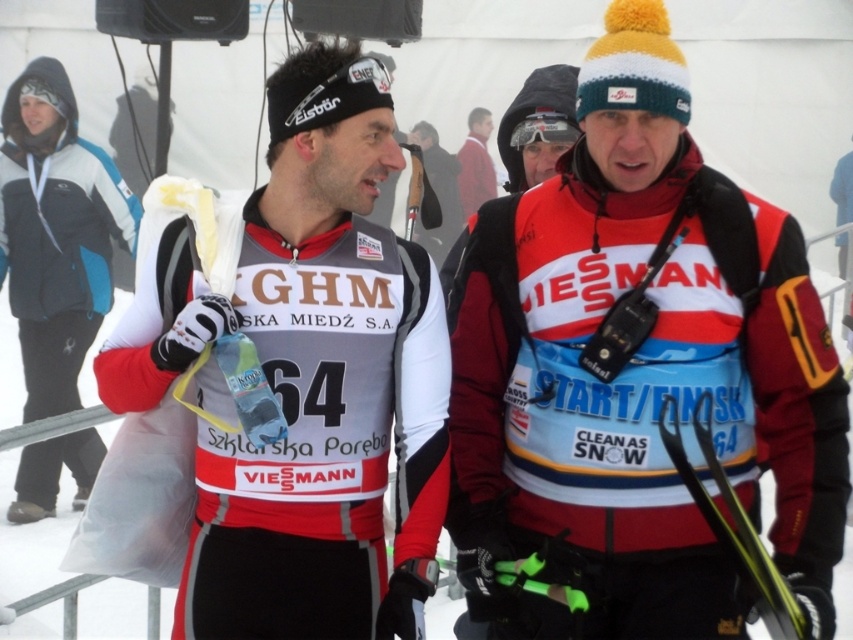
Between matte white jersey at center and matte black goggles at center, which one has more height?

Standing taller between the two is matte white jersey at center.

Can you confirm if matte white jersey at center is positioned below matte black goggles at center?

Yes.

Locate an element on the screen. matte white jersey at center is located at coordinates [310, 380].

Is red fabric jacket at center to the left of yellow metallic ski at lower right from the viewer's perspective?

Indeed, red fabric jacket at center is positioned on the left side of yellow metallic ski at lower right.

Which is below, red fabric jacket at center or yellow metallic ski at lower right?

yellow metallic ski at lower right is below.

Where is `red fabric jacket at center`? Image resolution: width=853 pixels, height=640 pixels. red fabric jacket at center is located at coordinates (636, 371).

Can you confirm if yellow metallic ski at lower right is positioned to the left of matte black goggles at center?

Incorrect, yellow metallic ski at lower right is not on the left side of matte black goggles at center.

Which of these two, yellow metallic ski at lower right or matte black goggles at center, stands shorter?

With less height is matte black goggles at center.

Which is in front, point (741, 512) or point (520, 141)?

Positioned in front is point (741, 512).

What are the coordinates of `yellow metallic ski at lower right` in the screenshot? It's located at (x=734, y=524).